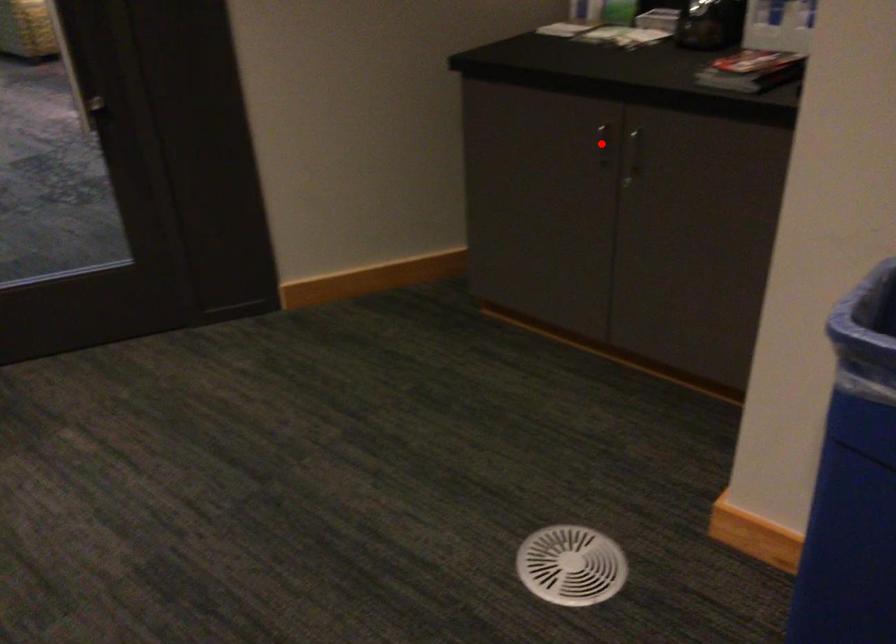
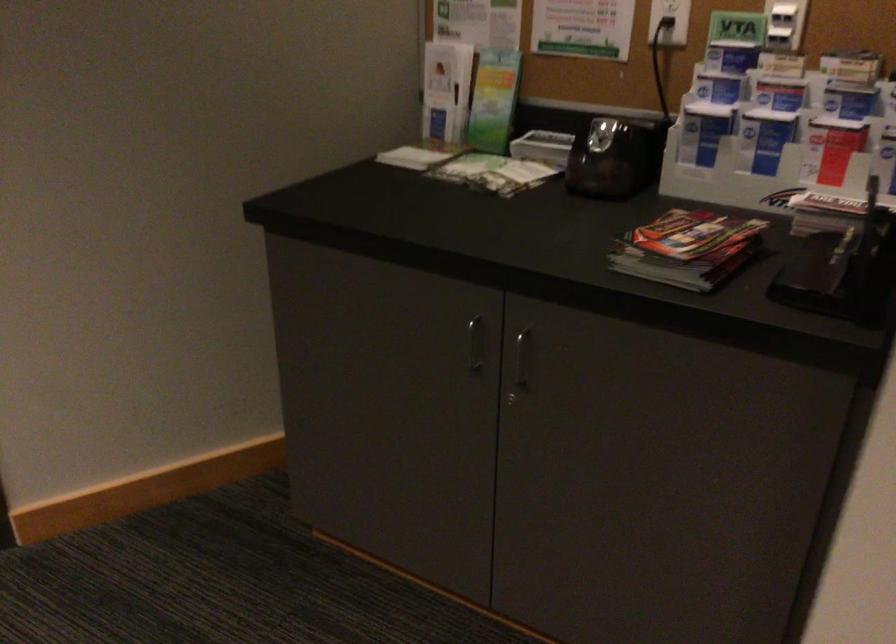
Question: I am providing you with two images of the same scene from different viewpoints. Given a red point in image1, look at the same physical point in image2. Is it:

Choices:
 (A) Closer to the viewpoint
 (B) Farther from the viewpoint

Answer: (A)